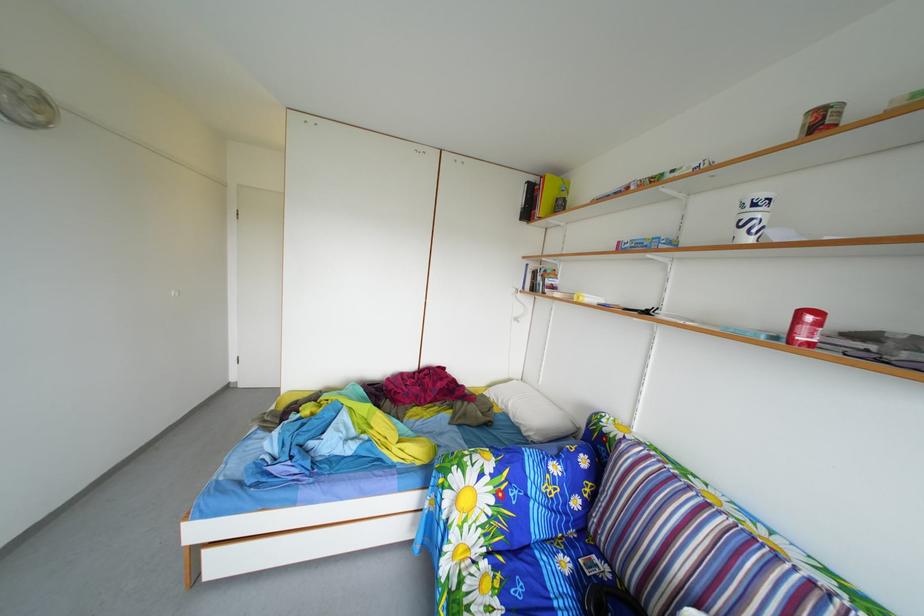
Identify the location of patterned paper cup. (751, 217).